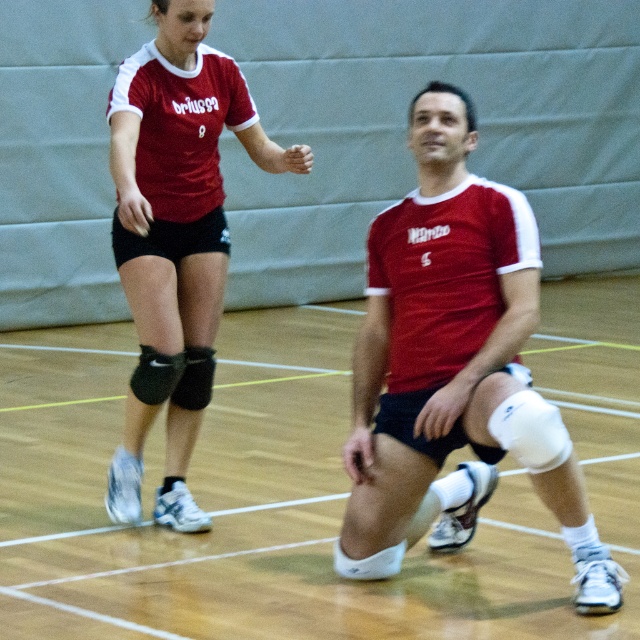
Question: Can you confirm if matte red jersey at upper left is wider than black matte knee pad at lower left?

Choices:
 (A) no
 (B) yes

Answer: (B)

Question: Is matte red jersey at center wider than black matte knee pad at lower left?

Choices:
 (A) no
 (B) yes

Answer: (B)

Question: Which point is closer to the camera taking this photo?

Choices:
 (A) (196, 387)
 (B) (150, 355)
 (C) (452, 109)

Answer: (C)

Question: Can you confirm if matte red jersey at center is positioned above black matte knee pad at lower left?

Choices:
 (A) yes
 (B) no

Answer: (A)

Question: Which of the following is the closest to the observer?

Choices:
 (A) (134, 403)
 (B) (438, 225)

Answer: (B)

Question: Which point is closer to the camera?

Choices:
 (A) matte red jersey at center
 (B) matte red jersey at upper left
 (C) black matte knee pad at lower left

Answer: (A)